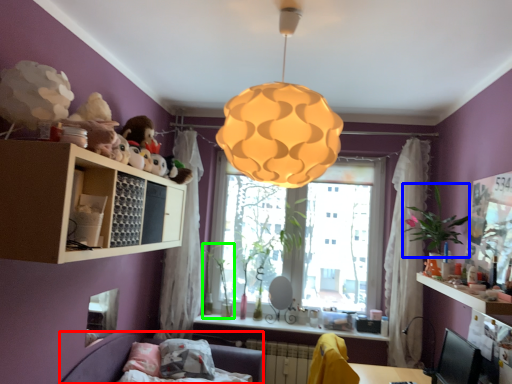
Question: Considering the real-world distances, which object is closest to couch (highlighted by a red box)? plant (highlighted by a blue box) or plant (highlighted by a green box).

Choices:
 (A) plant
 (B) plant

Answer: (B)